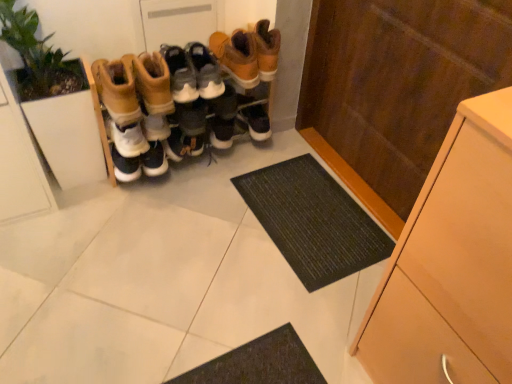
Identify the location of vacant space situated above black rubber doormat at center (from a real-world perspective). This screenshot has width=512, height=384. (311, 210).